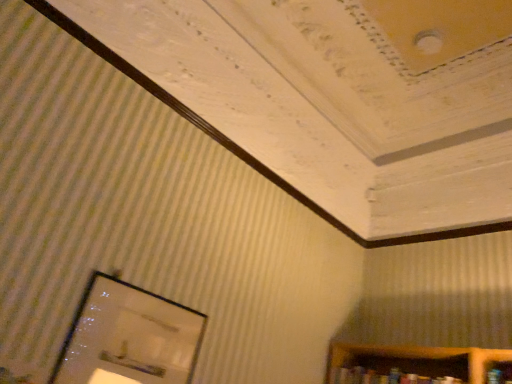
This screenshot has height=384, width=512. Describe the element at coordinates (129, 337) in the screenshot. I see `matte glass picture frame at lower left` at that location.

The height and width of the screenshot is (384, 512). Identify the location of matte glass picture frame at lower left. (129, 337).

Find the location of `hardcover book at lower right`. hardcover book at lower right is located at coordinates (385, 377).

The image size is (512, 384). What do you see at coordinates (385, 377) in the screenshot?
I see `hardcover book at lower right` at bounding box center [385, 377].

This screenshot has width=512, height=384. In order to click on matte glass picture frame at lower left in this screenshot , I will do (x=129, y=337).

Is hardcover book at lower right to the left or to the right of matte glass picture frame at lower left in the image?

From the image, it's evident that hardcover book at lower right is to the right of matte glass picture frame at lower left.

Which object is closer to the camera, hardcover book at lower right or matte glass picture frame at lower left?

matte glass picture frame at lower left is closer to the camera.

Which is farther, (358, 380) or (101, 380)?

Point (358, 380)

From the image's perspective, is hardcover book at lower right on matte glass picture frame at lower left?

No, from the image's perspective, hardcover book at lower right is not above matte glass picture frame at lower left.

From a real-world perspective, is hardcover book at lower right over matte glass picture frame at lower left?

Correct, in the physical world, hardcover book at lower right is higher than matte glass picture frame at lower left.

Considering the relative sizes of hardcover book at lower right and matte glass picture frame at lower left in the image provided, is hardcover book at lower right thinner than matte glass picture frame at lower left?

No.

From their relative heights in the image, would you say hardcover book at lower right is taller or shorter than matte glass picture frame at lower left?

hardcover book at lower right is shorter than matte glass picture frame at lower left.

Looking at the image, does hardcover book at lower right seem bigger or smaller compared to matte glass picture frame at lower left?

Clearly, hardcover book at lower right is larger in size than matte glass picture frame at lower left.

Is hardcover book at lower right inside or outside of matte glass picture frame at lower left?

hardcover book at lower right is spatially situated outside matte glass picture frame at lower left.

Is hardcover book at lower right placed right next to matte glass picture frame at lower left?

hardcover book at lower right and matte glass picture frame at lower left are not in contact.

Is hardcover book at lower right looking in the opposite direction of matte glass picture frame at lower left?

hardcover book at lower right is not turned away from matte glass picture frame at lower left.

What's the angular difference between hardcover book at lower right and matte glass picture frame at lower left's facing directions?

There is a 91.1-degree angle between the facing directions of hardcover book at lower right and matte glass picture frame at lower left.

Based on the photo, how distant is hardcover book at lower right from matte glass picture frame at lower left?

1.30 meters.

Image resolution: width=512 pixels, height=384 pixels. What are the coordinates of `book behind the matte glass picture frame at lower left` in the screenshot? It's located at point(385,377).

Which object is positioned more to the left, matte glass picture frame at lower left or hardcover book at lower right?

Positioned to the left is matte glass picture frame at lower left.

Does matte glass picture frame at lower left come behind hardcover book at lower right?

No.

Is point (153, 352) closer to viewer compared to point (445, 379)?

Yes, point (153, 352) is closer to viewer.

In the scene shown: From the image's perspective, is matte glass picture frame at lower left below hardcover book at lower right?

No, from the image's perspective, matte glass picture frame at lower left is not below hardcover book at lower right.

From a real-world perspective, is matte glass picture frame at lower left positioned above or below hardcover book at lower right?

matte glass picture frame at lower left is below hardcover book at lower right.

Considering the sizes of objects matte glass picture frame at lower left and hardcover book at lower right in the image provided, who is thinner, matte glass picture frame at lower left or hardcover book at lower right?

matte glass picture frame at lower left.

Looking at this image, does matte glass picture frame at lower left have a lesser height compared to hardcover book at lower right?

No, matte glass picture frame at lower left is not shorter than hardcover book at lower right.

Is matte glass picture frame at lower left bigger than hardcover book at lower right?

Actually, matte glass picture frame at lower left might be smaller than hardcover book at lower right.

Is matte glass picture frame at lower left outside of hardcover book at lower right?

Yes, matte glass picture frame at lower left is outside of hardcover book at lower right.

Is matte glass picture frame at lower left directly adjacent to hardcover book at lower right?

matte glass picture frame at lower left and hardcover book at lower right are not in contact.

Is matte glass picture frame at lower left looking in the opposite direction of hardcover book at lower right?

No, matte glass picture frame at lower left's orientation is not away from hardcover book at lower right.

How different are the orientations of matte glass picture frame at lower left and hardcover book at lower right in degrees?

The angular difference between matte glass picture frame at lower left and hardcover book at lower right is 91.1 degrees.

How distant is matte glass picture frame at lower left from hardcover book at lower right?

matte glass picture frame at lower left is 4.27 feet away from hardcover book at lower right.

You are a GUI agent. You are given a task and a screenshot of the screen. Output one action in this format:
    pyautogui.click(x=<x>, y=<y>)
    Task: Click on the book that is below the matte glass picture frame at lower left (from the image's perspective)
    
    Given the screenshot: What is the action you would take?
    pyautogui.click(x=385, y=377)

Image resolution: width=512 pixels, height=384 pixels. I want to click on picture frame on the left of hardcover book at lower right, so click(129, 337).

You are a GUI agent. You are given a task and a screenshot of the screen. Output one action in this format:
    pyautogui.click(x=<x>, y=<y>)
    Task: Click on the book that is behind the matte glass picture frame at lower left
    This screenshot has height=384, width=512.
    Given the screenshot: What is the action you would take?
    pyautogui.click(x=385, y=377)